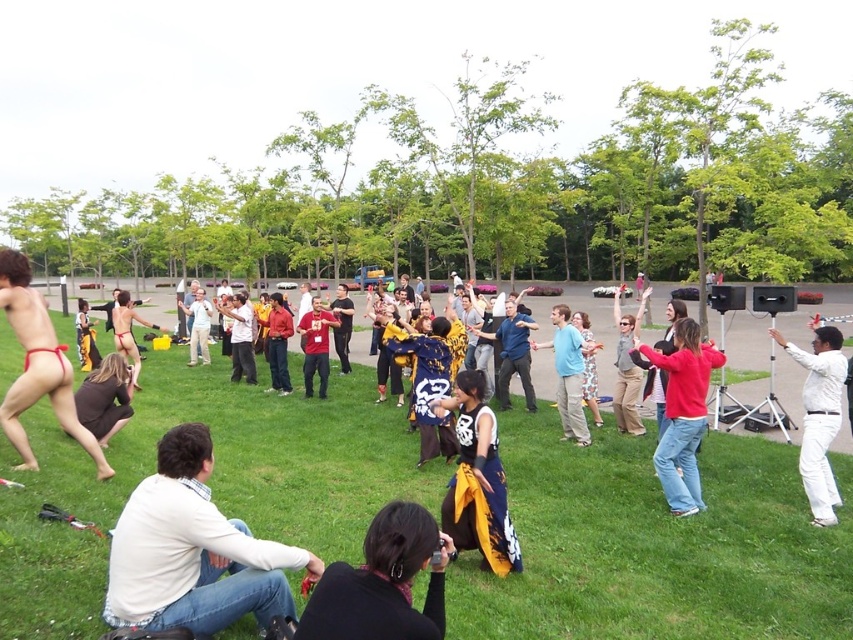
You are a photographer at the event and want to take a photo of both the white cotton shirt at lower left and the dark blue shirt at center. Since you want to include both in the frame, which shirt should you focus on to ensure both are in focus?

You should focus on the dark blue shirt at center because it is larger than the white cotton shirt at lower left, making it easier to keep both in focus by focusing on the closer or larger subject.

You are a photographer at this event and want to capture a photo of both the blue denim jeans at center and dark blue shirt at center in the same frame. Based on their positions, which one should you focus on first to ensure both are in the frame?

The blue denim jeans at center is located below dark blue shirt at center, so you should focus on the dark blue shirt at center first to ensure both are in the frame.